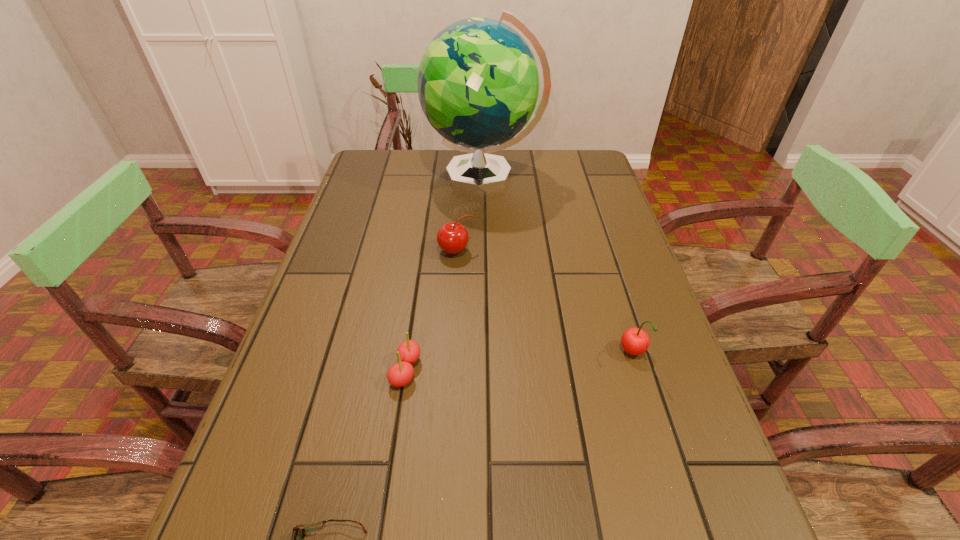
Locate an element on the screen. This screenshot has width=960, height=540. blank space located on the front of the rightmost cherry is located at coordinates (647, 399).

This screenshot has height=540, width=960. In order to click on free region located 0.230m on the right of the fourth nearest object in this screenshot , I will do [564, 251].

This screenshot has height=540, width=960. I want to click on vacant space located 0.210m on the left of the shortest cherry, so click(283, 370).

Locate an element on the screen. This screenshot has height=540, width=960. object that is at the far edge is located at coordinates (478, 82).

Identify the location of object that is at the right edge. The width and height of the screenshot is (960, 540). (635, 341).

In order to click on vacant space at the far edge in this screenshot , I will do `click(438, 159)`.

Find the location of `free location at the left edge`. free location at the left edge is located at coordinates (374, 212).

The height and width of the screenshot is (540, 960). What are the coordinates of `vacant space at the right edge of the desktop` in the screenshot? It's located at (612, 322).

Find the location of a particular element. The image size is (960, 540). vacant space at the far left corner is located at coordinates (364, 172).

At what (x,y) coordinates should I click in order to perform the action: click on vacant space at the far right corner of the desktop. Please return your answer as a coordinate pair (x, y). Looking at the image, I should click on (570, 165).